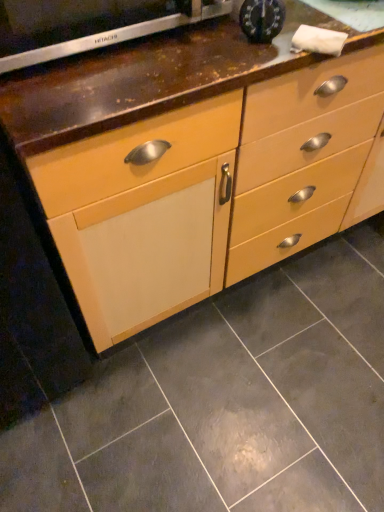
Find the location of a particular element. This screenshot has width=384, height=512. blank space situated above matte gray tile at center (from a real-world perspective) is located at coordinates (254, 370).